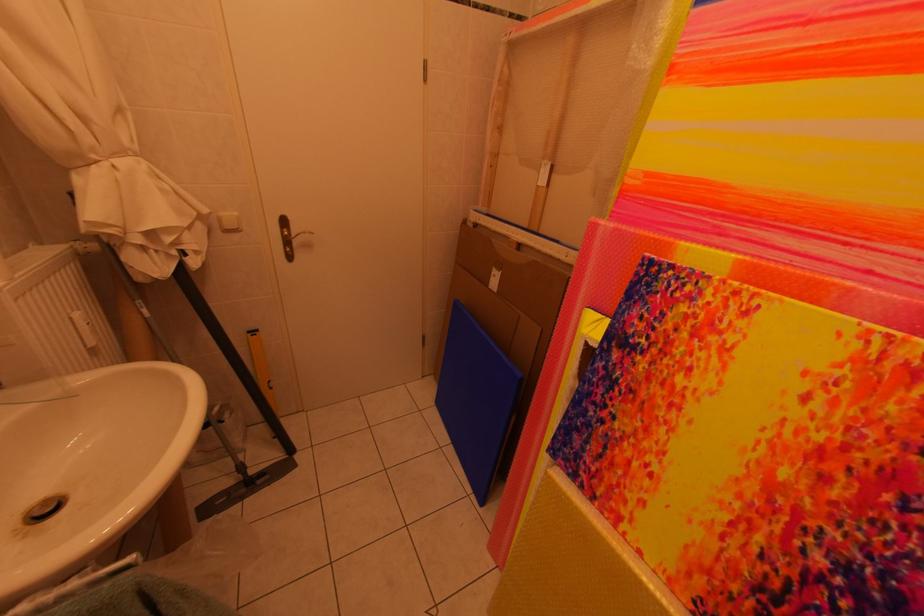
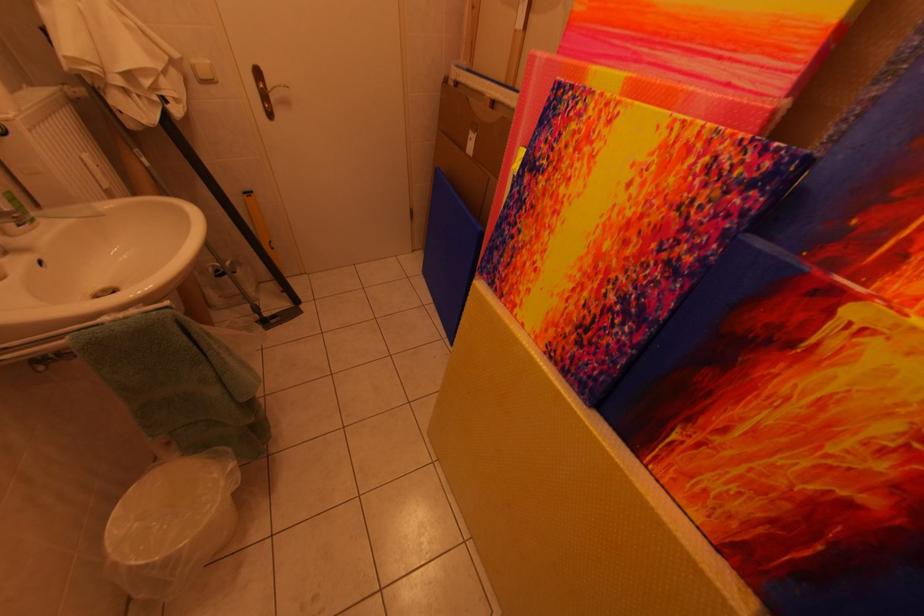
The point at (246, 469) is marked in the first image. Where is the corresponding point in the second image?

(261, 310)